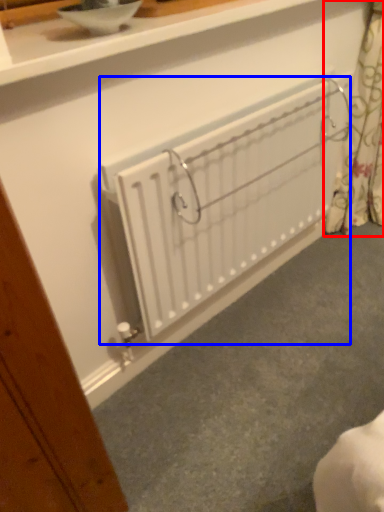
Question: Which object appears farthest to the camera in this image, curtain (highlighted by a red box) or radiator (highlighted by a blue box)?

Choices:
 (A) curtain
 (B) radiator

Answer: (A)